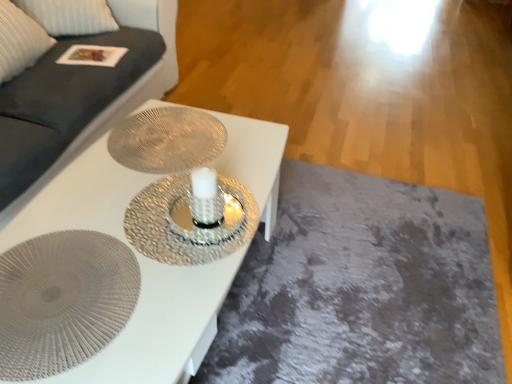
Question: From a real-world perspective, is textured silver plate at center, the 1th oval when ordered from bottom to top, positioned under metallic textured plate at center, positioned as the 1th oval in back-to-front order, based on gravity?

Choices:
 (A) yes
 (B) no

Answer: (B)

Question: Is textured silver plate at center, which is counted as the second oval, starting from the back, at the right side of metallic textured plate at center, marked as the 1th oval in a top-to-bottom arrangement?

Choices:
 (A) no
 (B) yes

Answer: (A)

Question: Can you confirm if textured silver plate at center, positioned as the first oval in front-to-back order, is shorter than metallic textured plate at center, the 2th oval when ordered from front to back?

Choices:
 (A) no
 (B) yes

Answer: (B)

Question: From a real-world perspective, does textured silver plate at center, which is the 2th oval in top-to-bottom order, stand above metallic textured plate at center, positioned as the 2th oval in bottom-to-top order?

Choices:
 (A) yes
 (B) no

Answer: (A)

Question: From the image's perspective, is textured silver plate at center, the 1th oval when ordered from bottom to top, above metallic textured plate at center, marked as the 1th oval in a top-to-bottom arrangement?

Choices:
 (A) no
 (B) yes

Answer: (A)

Question: Is textured silver plate at center, which is the 2th oval in top-to-bottom order, facing towards metallic textured plate at center, positioned as the 1th oval in back-to-front order?

Choices:
 (A) no
 (B) yes

Answer: (A)

Question: Does textured silver plate at center, which is counted as the second oval, starting from the back, have a greater height compared to dark gray fabric couch at upper left?

Choices:
 (A) yes
 (B) no

Answer: (B)

Question: Does textured silver plate at center, which is the 2th oval in top-to-bottom order, lie behind dark gray fabric couch at upper left?

Choices:
 (A) no
 (B) yes

Answer: (A)

Question: From a real-world perspective, is textured silver plate at center, positioned as the first oval in front-to-back order, located beneath dark gray fabric couch at upper left?

Choices:
 (A) yes
 (B) no

Answer: (B)

Question: Does textured silver plate at center, which is the 2th oval in top-to-bottom order, turn towards dark gray fabric couch at upper left?

Choices:
 (A) yes
 (B) no

Answer: (B)

Question: Is textured silver plate at center, which is counted as the second oval, starting from the back, not inside dark gray fabric couch at upper left?

Choices:
 (A) yes
 (B) no

Answer: (A)

Question: Is textured silver plate at center, which is the 2th oval in top-to-bottom order, at the left side of dark gray fabric couch at upper left?

Choices:
 (A) no
 (B) yes

Answer: (A)

Question: Is metallic textured plate at center, the 2th oval when ordered from front to back, outside of white textured table at center?

Choices:
 (A) no
 (B) yes

Answer: (A)